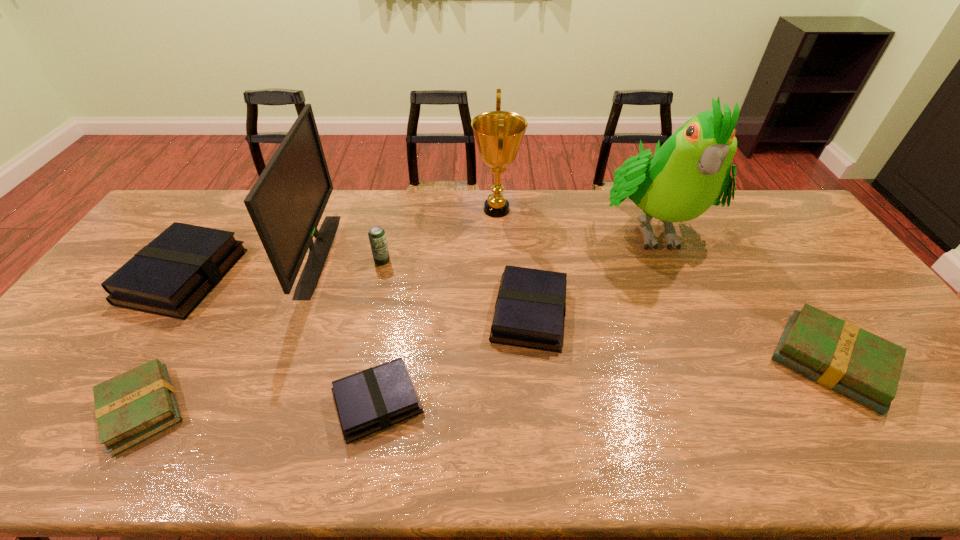
The image size is (960, 540). In order to click on parakeet in this screenshot , I will do `click(683, 179)`.

The width and height of the screenshot is (960, 540). Identify the location of green parakeet. (683, 179).

Locate an element on the screen. Image resolution: width=960 pixels, height=540 pixels. award is located at coordinates (498, 134).

At what (x,y) coordinates should I click in order to perform the action: click on monitor. Please return your answer as a coordinate pair (x, y). Looking at the image, I should click on (286, 203).

Identify the location of beer can. The width and height of the screenshot is (960, 540). (376, 234).

Image resolution: width=960 pixels, height=540 pixels. In order to click on the fifth tallest object in this screenshot , I will do `click(170, 276)`.

This screenshot has width=960, height=540. I want to click on the biggest blue book, so coord(170,276).

You are a GUI agent. You are given a task and a screenshot of the screen. Output one action in this format:
    pyautogui.click(x=<x>, y=<y>)
    Task: Click on the second biggest blue book
    Image resolution: width=960 pixels, height=540 pixels.
    Given the screenshot: What is the action you would take?
    pyautogui.click(x=530, y=308)

Find the location of a particular element. the fourth book from left to right is located at coordinates (530, 308).

Image resolution: width=960 pixels, height=540 pixels. In order to click on the right yellow book in this screenshot , I will do `click(866, 368)`.